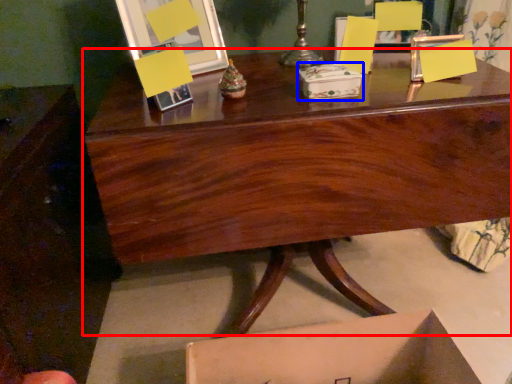
Question: Which object is further to the camera taking this photo, desk (highlighted by a red box) or storage box (highlighted by a blue box)?

Choices:
 (A) desk
 (B) storage box

Answer: (B)